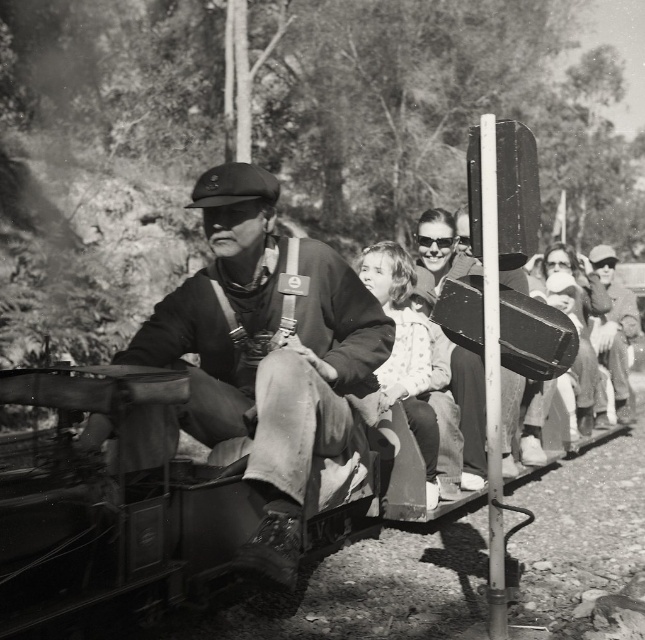
Question: Among these points, which one is farthest from the camera?

Choices:
 (A) (281, 323)
 (B) (395, 390)

Answer: (B)

Question: Which point is closer to the camera taking this photo?

Choices:
 (A) (272, 256)
 (B) (410, 272)

Answer: (A)

Question: Is the position of leather seat at center more distant than that of light beige fabric dress at center?

Choices:
 (A) no
 (B) yes

Answer: (A)

Question: Is leather seat at center further to the viewer compared to light beige fabric dress at center?

Choices:
 (A) no
 (B) yes

Answer: (A)

Question: Which point appears farthest from the camera in this image?

Choices:
 (A) (413, 352)
 (B) (104, 429)

Answer: (A)

Question: From the image, what is the correct spatial relationship of leather seat at center in relation to light beige fabric dress at center?

Choices:
 (A) above
 (B) below

Answer: (B)